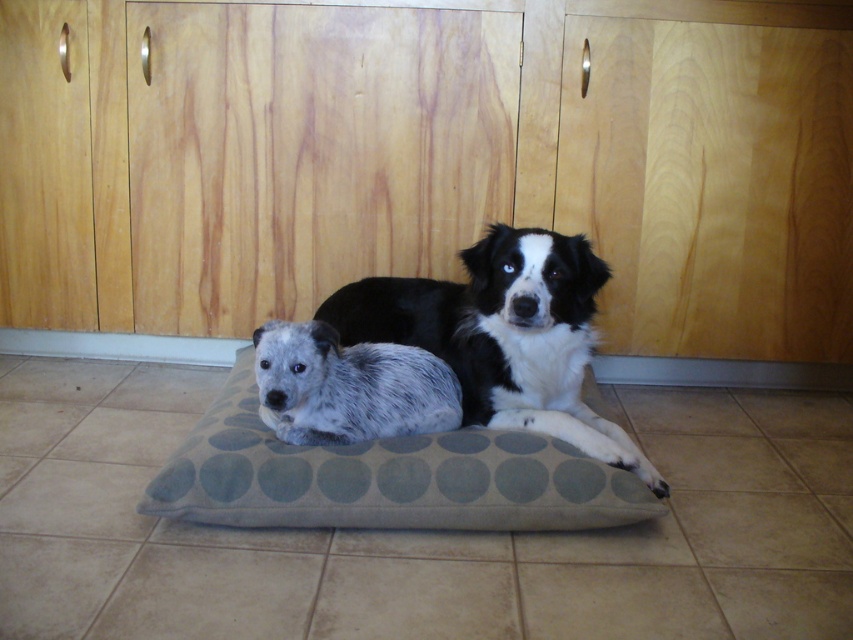
Which is above, gray dotted fabric dog bed at center or black and white fur dog at center?

black and white fur dog at center is above.

Is point (486, 461) farther from viewer compared to point (480, 259)?

No, (486, 461) is closer to viewer.

Image resolution: width=853 pixels, height=640 pixels. Find the location of `gray dotted fabric dog bed at center`. gray dotted fabric dog bed at center is located at coordinates (386, 477).

Does point (280, 468) lie behind point (384, 392)?

No, (280, 468) is closer to viewer.

Between gray dotted fabric dog bed at center and spotted fur dog at center, which one appears on the right side from the viewer's perspective?

gray dotted fabric dog bed at center

Who is more forward, (177, 506) or (357, 356)?

Point (177, 506) is more forward.

Where is `gray dotted fabric dog bed at center`? The width and height of the screenshot is (853, 640). gray dotted fabric dog bed at center is located at coordinates (386, 477).

Is point (519, 401) positioned before point (265, 340)?

That is False.

Find the location of a particular element. This screenshot has height=640, width=853. black and white fur dog at center is located at coordinates (503, 336).